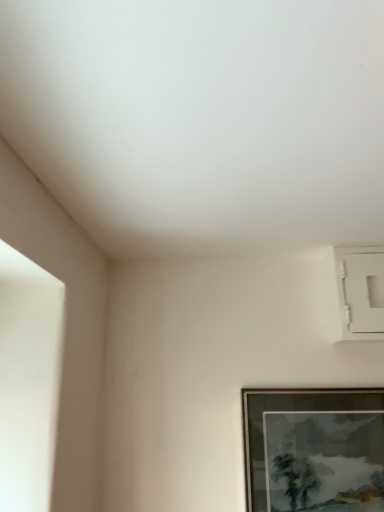
Question: Should I look upward or downward to see wooden framed painting at lower right?

Choices:
 (A) down
 (B) up

Answer: (A)